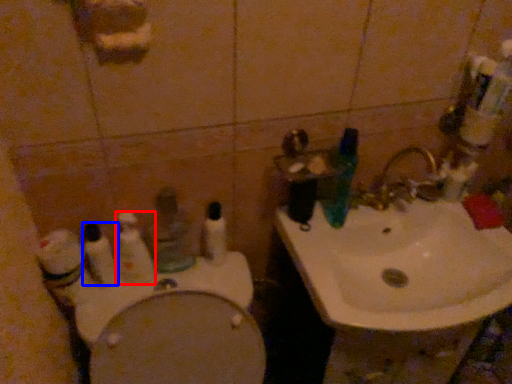
Question: Which of the following is the farthest to the observer, toothbrush (highlighted by a red box) or toothbrush (highlighted by a blue box)?

Choices:
 (A) toothbrush
 (B) toothbrush

Answer: (A)